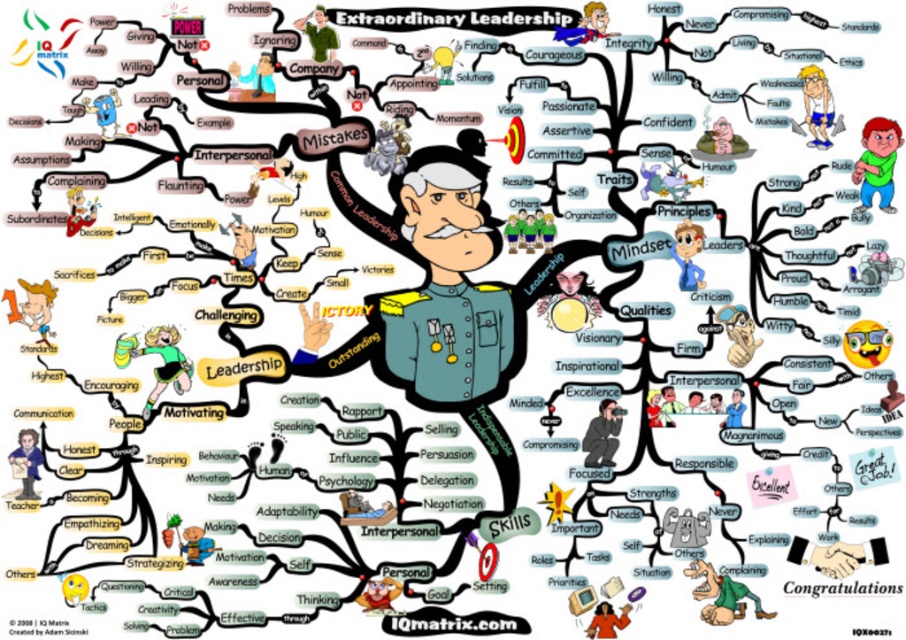
Is shiny gold helmet at upper right wider than matte yellow figure at center?

Yes.

Can you confirm if shiny gold helmet at upper right is positioned to the right of matte yellow figure at center?

Yes, shiny gold helmet at upper right is to the right of matte yellow figure at center.

Find the location of `shiny gold helmet at upper right`. shiny gold helmet at upper right is located at coordinates (816, 106).

Does green fabric figure at lower left have a larger size compared to matte black teacher at lower left?

Yes.

Between point (182, 358) and point (18, 435), which one is positioned in front?

Point (18, 435) is in front.

Is point (153, 348) positioned behind point (35, 460)?

Yes, it is.

The height and width of the screenshot is (640, 906). What are the coordinates of `green fabric figure at lower left` in the screenshot? It's located at (162, 360).

Consider the image. Is the position of green rubber toy at upper right more distant than that of green fabric figure at lower left?

No, green rubber toy at upper right is closer to the viewer.

Is green rubber toy at upper right above green fabric figure at lower left?

Correct, green rubber toy at upper right is located above green fabric figure at lower left.

Between point (890, 156) and point (124, 358), which one is positioned behind?

The point (124, 358) is behind.

Find the location of a particular element. The image size is (906, 640). green rubber toy at upper right is located at coordinates (876, 161).